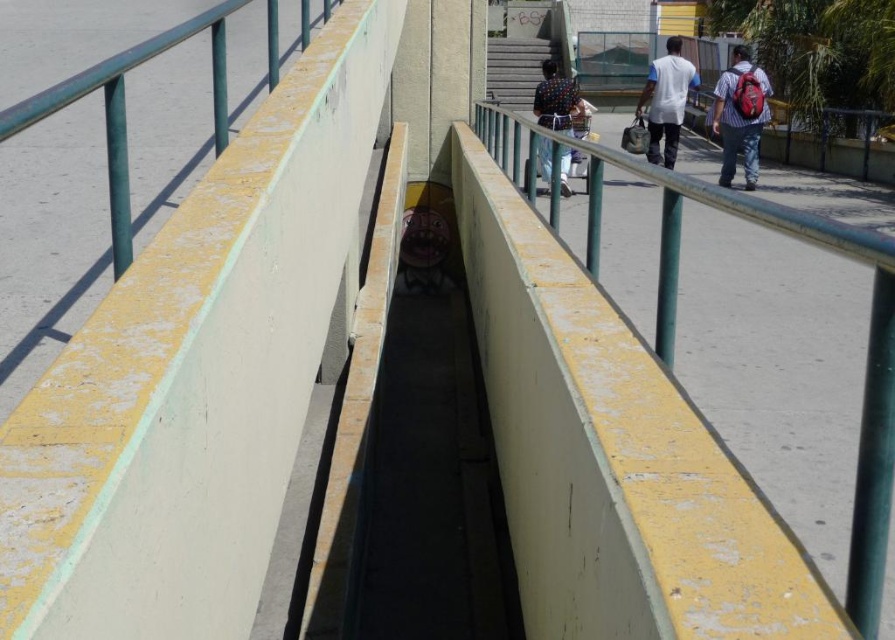
Question: Estimate the real-world distances between objects in this image. Which object is farther from the white matte shirt at upper right?

Choices:
 (A) stone stairs at upper center
 (B) yellow painted metal rail at center
 (C) striped cotton shirt at right
 (D) polka dot shirt at center

Answer: (A)

Question: Can you confirm if stone stairs at upper center is smaller than polka dot shirt at center?

Choices:
 (A) yes
 (B) no

Answer: (A)

Question: Which point appears farthest from the camera in this image?

Choices:
 (A) (874, 461)
 (B) (514, 65)

Answer: (B)

Question: Considering the relative positions of yellow painted metal rail at center and stone stairs at upper center in the image provided, where is yellow painted metal rail at center located with respect to stone stairs at upper center?

Choices:
 (A) right
 (B) left

Answer: (B)

Question: Is yellow painted metal rail at center smaller than white matte shirt at upper right?

Choices:
 (A) no
 (B) yes

Answer: (B)

Question: Which point is farther to the camera?

Choices:
 (A) stone stairs at upper center
 (B) white matte shirt at upper right
 (C) striped cotton shirt at right

Answer: (A)